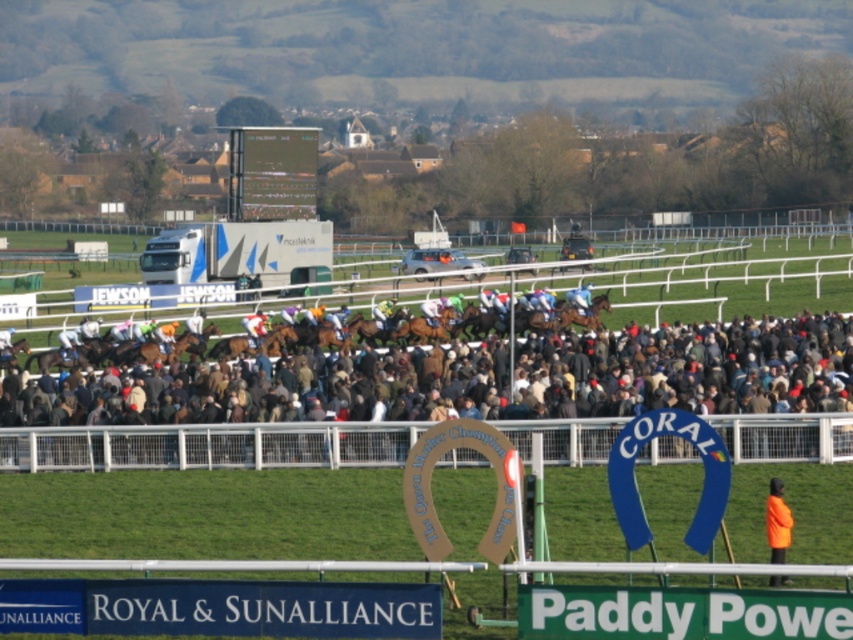
Between brown woolen coat at center and orange reflective jacket at lower right, which one appears on the left side from the viewer's perspective?

brown woolen coat at center

Can you confirm if brown woolen coat at center is positioned above orange reflective jacket at lower right?

Correct, brown woolen coat at center is located above orange reflective jacket at lower right.

Does point (817, 422) come farther from viewer compared to point (778, 554)?

Yes, point (817, 422) is farther from viewer.

The width and height of the screenshot is (853, 640). Identify the location of brown woolen coat at center. (445, 397).